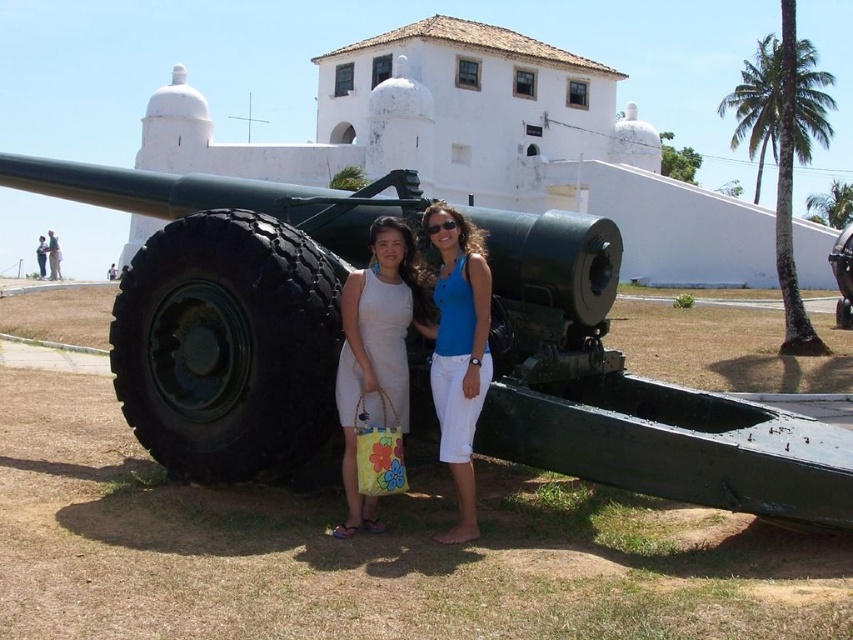
Does green matte cannon at center appear on the right side of white fabric dress at center?

In fact, green matte cannon at center is to the left of white fabric dress at center.

Consider the image. Can you confirm if green matte cannon at center is smaller than white fabric dress at center?

No, green matte cannon at center is not smaller than white fabric dress at center.

From the picture: Who is more distant from viewer, (200, 212) or (422, 310)?

The point (422, 310) is more distant.

This screenshot has height=640, width=853. I want to click on green matte cannon at center, so click(x=225, y=308).

Can you confirm if green matte cannon at center is thinner than green leafy palm tree at right?

Correct, green matte cannon at center's width is less than green leafy palm tree at right's.

Is green matte cannon at center to the right of green leafy palm tree at right from the viewer's perspective?

In fact, green matte cannon at center is to the left of green leafy palm tree at right.

The image size is (853, 640). What do you see at coordinates (225, 308) in the screenshot?
I see `green matte cannon at center` at bounding box center [225, 308].

This screenshot has height=640, width=853. Find the location of `green matte cannon at center`. green matte cannon at center is located at coordinates (225, 308).

Consider the image. Can you confirm if green leafy palm tree at right is wider than blue cotton tank top at center?

Yes, green leafy palm tree at right is wider than blue cotton tank top at center.

The height and width of the screenshot is (640, 853). What do you see at coordinates (782, 147) in the screenshot?
I see `green leafy palm tree at right` at bounding box center [782, 147].

Locate an element on the screen. The width and height of the screenshot is (853, 640). green leafy palm tree at right is located at coordinates (782, 147).